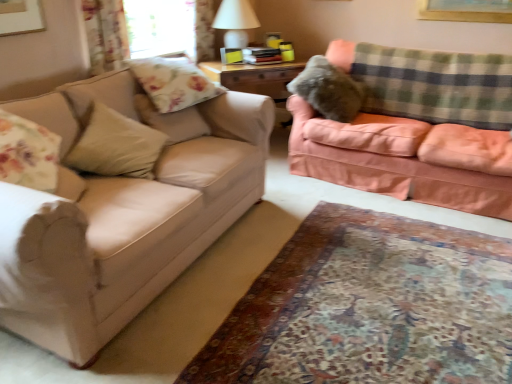
What do you see at coordinates (436, 85) in the screenshot? This screenshot has height=384, width=512. I see `green plaid blanket at upper right` at bounding box center [436, 85].

Describe the element at coordinates (116, 145) in the screenshot. I see `beige fabric pillow at left, positioned as the 1th pillow in front-to-back order` at that location.

You are a GUI agent. You are given a task and a screenshot of the screen. Output one action in this format:
    pyautogui.click(x=<x>, y=<y>)
    Task: Click on the matte beige couch at left, the 2th studio couch viewed from the right
    The image size is (512, 384).
    Given the screenshot: What is the action you would take?
    pos(128,227)

From a real-world perspective, which is physically below, peach velvety couch at right, the first studio couch when ordered from right to left, or matte beige couch at left, the 2th studio couch viewed from the right?

matte beige couch at left, the 2th studio couch viewed from the right, is physically lower.

Which object is positioned more to the right, peach velvety couch at right, the second studio couch viewed from the left, or matte beige couch at left, the 2th studio couch viewed from the right?

peach velvety couch at right, the second studio couch viewed from the left, is more to the right.

Consider the image. Is there a large distance between peach velvety couch at right, the second studio couch viewed from the left, and matte beige couch at left, the 2th studio couch viewed from the right?

Yes, peach velvety couch at right, the second studio couch viewed from the left, is far from matte beige couch at left, the 2th studio couch viewed from the right.

Which object is wider, peach velvety couch at right, the first studio couch when ordered from right to left, or matte beige couch at left, the 2th studio couch viewed from the right?

With larger width is matte beige couch at left, the 2th studio couch viewed from the right.

From the image's perspective, between floral fabric curtain at upper left and matte beige couch at left, the 1th studio couch viewed from the left, which one is located above?

floral fabric curtain at upper left appears higher in the image.

From the image's perspective, count 2nd studio couchs downward from the floral fabric curtain at upper left and point to it. Please provide its 2D coordinates.

[(128, 227)]

Which of these two, floral fabric curtain at upper left or matte beige couch at left, the 2th studio couch viewed from the right, stands taller?

matte beige couch at left, the 2th studio couch viewed from the right, is taller.

Based on the photo, in terms of height, does white matte table lamp at upper center look taller or shorter compared to beige fabric pillow at left, acting as the third pillow starting from the back?

Considering their sizes, white matte table lamp at upper center has more height than beige fabric pillow at left, acting as the third pillow starting from the back.

Do you think white matte table lamp at upper center is within beige fabric pillow at left, the 1th pillow when ordered from left to right, or outside of it?

white matte table lamp at upper center is not inside beige fabric pillow at left, the 1th pillow when ordered from left to right, it's outside.

Are white matte table lamp at upper center and beige fabric pillow at left, acting as the third pillow starting from the back, located far from each other?

white matte table lamp at upper center is positioned a significant distance from beige fabric pillow at left, acting as the third pillow starting from the back.

From a real-world perspective, which is physically below, white matte table lamp at upper center or beige fabric pillow at left, positioned as the 1th pillow in front-to-back order?

In real-world perspective, beige fabric pillow at left, positioned as the 1th pillow in front-to-back order, is lower.

In the image, is floral fabric pillow at upper left, the second pillow in the right-to-left sequence, on the left side or the right side of peach velvety couch at right, the second studio couch viewed from the left?

Answer: floral fabric pillow at upper left, the second pillow in the right-to-left sequence, is to the left of peach velvety couch at right, the second studio couch viewed from the left.

Is floral fabric pillow at upper left, the second pillow in the right-to-left sequence, behind peach velvety couch at right, the second studio couch viewed from the left?

Yes, floral fabric pillow at upper left, the second pillow in the right-to-left sequence, is further from the viewer.

Choose the correct answer: Is floral fabric pillow at upper left, the second pillow in the right-to-left sequence, inside peach velvety couch at right, the second studio couch viewed from the left, or outside it?

The correct answer is: outside.

Considering the relative positions of white matte table lamp at upper center and transparent glass window screen at upper center in the image provided, is white matte table lamp at upper center to the left of transparent glass window screen at upper center from the viewer's perspective?

In fact, white matte table lamp at upper center is to the right of transparent glass window screen at upper center.

Is white matte table lamp at upper center positioned far away from transparent glass window screen at upper center?

They are positioned close to each other.

Can you confirm if white matte table lamp at upper center is wider than transparent glass window screen at upper center?

Correct, the width of white matte table lamp at upper center exceeds that of transparent glass window screen at upper center.

Is white matte table lamp at upper center closer to the viewer compared to transparent glass window screen at upper center?

No, it is behind transparent glass window screen at upper center.

Looking at the image, does floral fabric pillow at upper left, marked as the second pillow in a left-to-right arrangement, seem bigger or smaller compared to carpet at lower center?

floral fabric pillow at upper left, marked as the second pillow in a left-to-right arrangement, is smaller than carpet at lower center.

Considering the sizes of objects floral fabric pillow at upper left, the second pillow in the right-to-left sequence, and carpet at lower center in the image provided, who is taller, floral fabric pillow at upper left, the second pillow in the right-to-left sequence, or carpet at lower center?

Standing taller between the two is floral fabric pillow at upper left, the second pillow in the right-to-left sequence.

Which is less distant, (136, 64) or (266, 319)?

Clearly, point (136, 64) is more distant from the camera than point (266, 319).

Which object is positioned more to the right, floral fabric pillow at upper left, which is the 2th pillow in back-to-front order, or carpet at lower center?

carpet at lower center is more to the right.

What's the angular difference between fuzzy fabric pillow at upper right, which is the 3th pillow from left to right, and transparent glass window screen at upper center's facing directions?

The facing directions of fuzzy fabric pillow at upper right, which is the 3th pillow from left to right, and transparent glass window screen at upper center are 93.8 degrees apart.

Which object is wider, fuzzy fabric pillow at upper right, the 1th pillow in the right-to-left sequence, or transparent glass window screen at upper center?

With larger width is fuzzy fabric pillow at upper right, the 1th pillow in the right-to-left sequence.

From the image's perspective, is fuzzy fabric pillow at upper right, placed as the 1th pillow when sorted from back to front, positioned above or below transparent glass window screen at upper center?

Clearly, from the image's perspective, fuzzy fabric pillow at upper right, placed as the 1th pillow when sorted from back to front, is below transparent glass window screen at upper center.

In the scene shown: Which is more to the left, fuzzy fabric pillow at upper right, the third pillow in the front-to-back sequence, or transparent glass window screen at upper center?

Positioned to the left is transparent glass window screen at upper center.

Identify the location of studio couch on the right of matte beige couch at left, the 1th studio couch viewed from the left. This screenshot has width=512, height=384. (416, 129).

Find the location of a particular element. This screenshot has height=384, width=512. the 2nd studio couch directly beneath the floral fabric curtain at upper left (from a real-world perspective) is located at coordinates (128, 227).

Consider the image. From the image, which object appears to be farther from floral fabric pillow at upper left, which is the 2th pillow in back-to-front order, matte beige couch at left, the 2th studio couch viewed from the right, or floral fabric curtain at upper left?

matte beige couch at left, the 2th studio couch viewed from the right, is further to floral fabric pillow at upper left, which is the 2th pillow in back-to-front order.

From the image, which object appears to be farther from beige fabric pillow at left, the 3th pillow viewed from the right, transparent glass window screen at upper center or green plaid blanket at upper right?

Based on the image, green plaid blanket at upper right appears to be further to beige fabric pillow at left, the 3th pillow viewed from the right.

From the picture: Considering their positions, is transparent glass window screen at upper center positioned closer to floral fabric pillow at upper left, which is the 2th pillow in back-to-front order, than carpet at lower center?

transparent glass window screen at upper center is positioned closer to the anchor floral fabric pillow at upper left, which is the 2th pillow in back-to-front order.

From the image, which object appears to be nearer to beige fabric pillow at left, positioned as the 1th pillow in front-to-back order, white matte table lamp at upper center or floral fabric pillow at upper left, the second pillow in the right-to-left sequence?

Among the two, floral fabric pillow at upper left, the second pillow in the right-to-left sequence, is located nearer to beige fabric pillow at left, positioned as the 1th pillow in front-to-back order.

Looking at the image, which one is located further to matte beige couch at left, the 2th studio couch viewed from the right, green plaid blanket at upper right or floral fabric curtain at upper left?

green plaid blanket at upper right.

Considering their positions, is matte beige couch at left, the 1th studio couch viewed from the left, positioned closer to peach velvety couch at right, the second studio couch viewed from the left, than floral fabric pillow at upper left, the second pillow in the right-to-left sequence?

floral fabric pillow at upper left, the second pillow in the right-to-left sequence, is closer to peach velvety couch at right, the second studio couch viewed from the left.

Looking at the image, which one is located closer to fuzzy fabric pillow at upper right, the 1th pillow in the right-to-left sequence, carpet at lower center or beige fabric pillow at left, acting as the third pillow starting from the back?

Based on the image, beige fabric pillow at left, acting as the third pillow starting from the back, appears to be nearer to fuzzy fabric pillow at upper right, the 1th pillow in the right-to-left sequence.

Estimate the real-world distances between objects in this image. Which object is closer to matte beige couch at left, the 2th studio couch viewed from the right, floral fabric curtain at upper left or fuzzy fabric pillow at upper right, which is the 3th pillow from left to right?

The object closer to matte beige couch at left, the 2th studio couch viewed from the right, is floral fabric curtain at upper left.

Locate an element on the screen. plain situated between matte beige couch at left, the 1th studio couch viewed from the left, and peach velvety couch at right, the second studio couch viewed from the left, from left to right is located at coordinates (370, 307).

Locate an element on the screen. The image size is (512, 384). studio couch between floral fabric curtain at upper left and peach velvety couch at right, the first studio couch when ordered from right to left, from left to right is located at coordinates (128, 227).

You are a GUI agent. You are given a task and a screenshot of the screen. Output one action in this format:
    pyautogui.click(x=<x>, y=<y>)
    Task: Click on the plain situated between transparent glass window screen at upper center and green plaid blanket at upper right from left to right
    The width and height of the screenshot is (512, 384).
    Given the screenshot: What is the action you would take?
    pyautogui.click(x=370, y=307)

I want to click on plain between floral fabric pillow at upper left, positioned as the second pillow in front-to-back order, and green plaid blanket at upper right from left to right, so click(x=370, y=307).